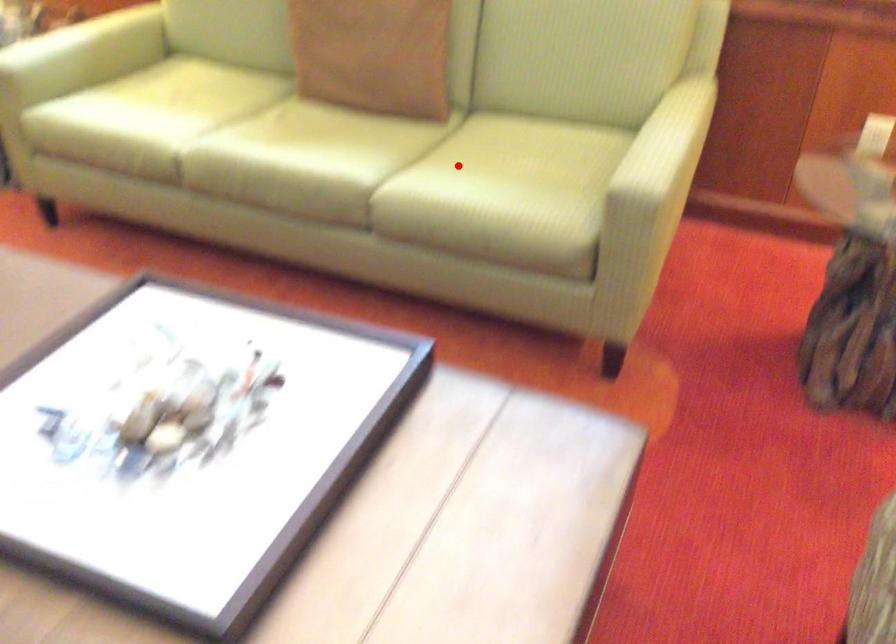
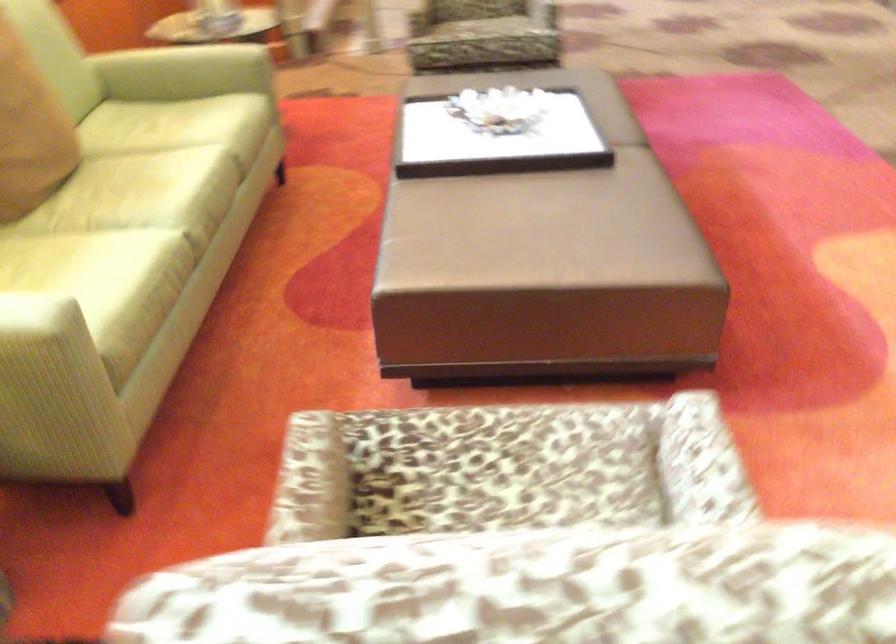
Where in the second image is the point corresponding to the highlighted location from the first image?

(177, 126)